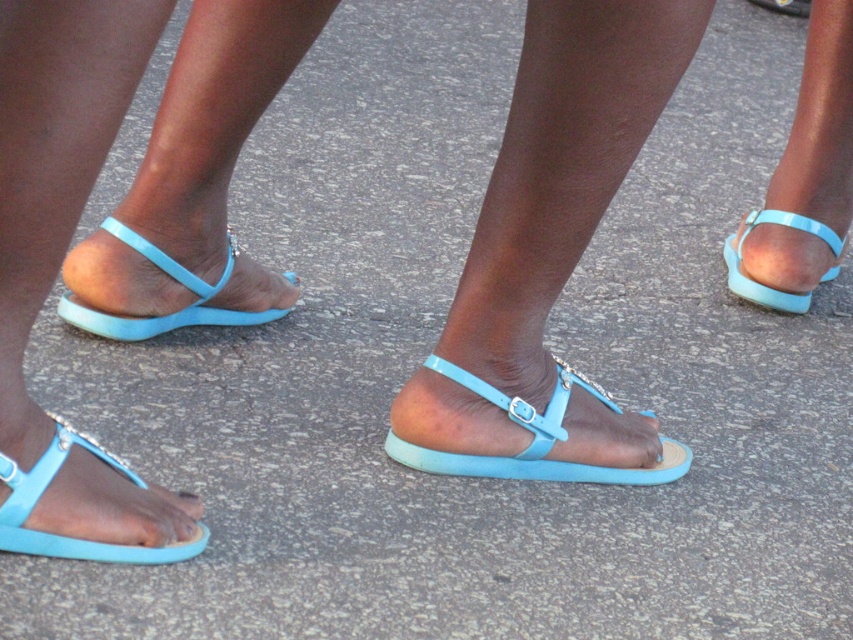
Question: Which point appears farthest from the camera in this image?

Choices:
 (A) (741, 228)
 (B) (73, 320)
 (C) (409, 442)
 (D) (114, 548)

Answer: (A)

Question: Is matte blue sandal at center above matte blue thong sandal at lower left?

Choices:
 (A) yes
 (B) no

Answer: (A)

Question: Is matte blue thong sandal at lower left smaller than matte blue sandal at right?

Choices:
 (A) no
 (B) yes

Answer: (B)

Question: Can you confirm if matte blue sandal at center is positioned to the right of matte blue thong sandal at lower left?

Choices:
 (A) yes
 (B) no

Answer: (A)

Question: Among these objects, which one is nearest to the camera?

Choices:
 (A) matte blue sandal at center
 (B) matte blue thong sandal at lower left

Answer: (B)

Question: Which point is farther to the camera?

Choices:
 (A) (200, 284)
 (B) (91, 452)
 (C) (546, 419)
 (D) (808, 227)

Answer: (D)